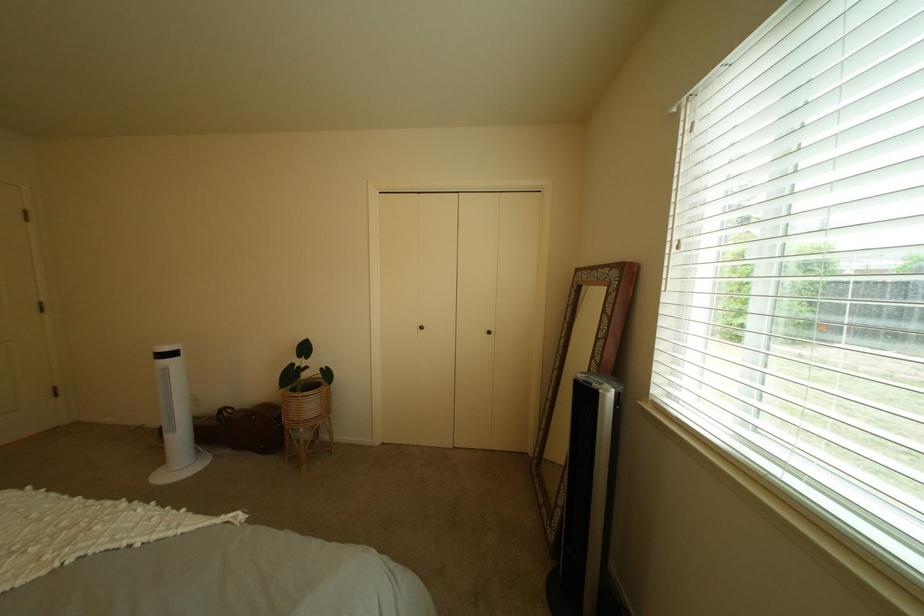
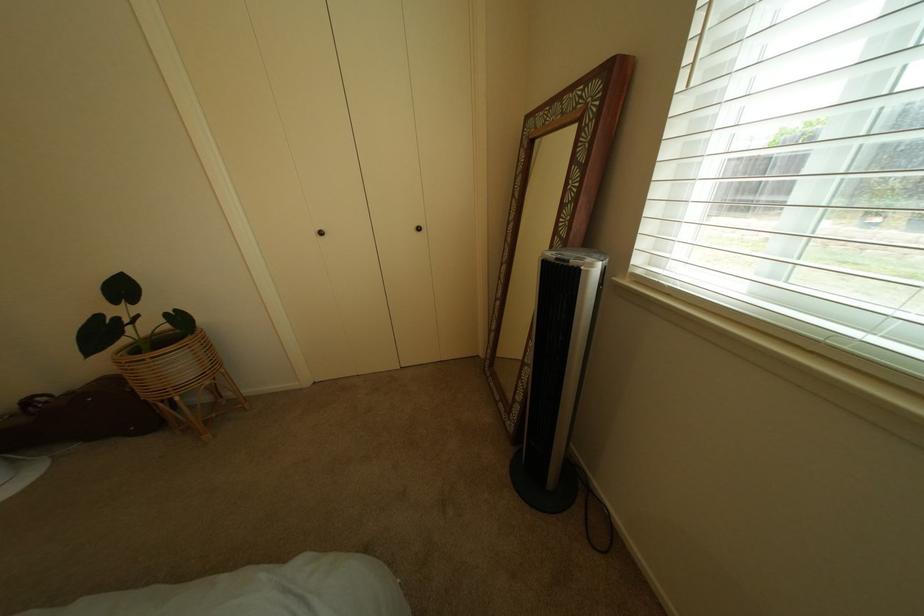
Where in the second image is the point corresponding to pixel 566 536 from the first image?

(527, 428)